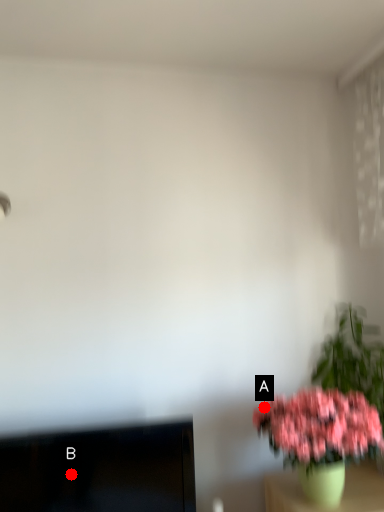
Question: Two points are circled on the image, labeled by A and B beside each circle. Which point is closer to the camera?

Choices:
 (A) A is closer
 (B) B is closer

Answer: (B)